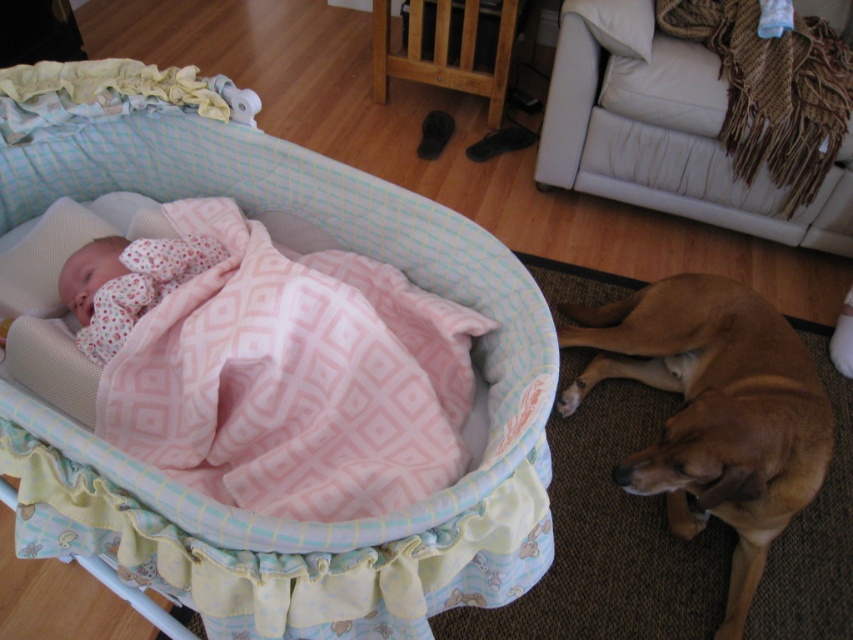
Question: Does brown smooth dog at lower right appear over fluffy pink blanket at center?

Choices:
 (A) yes
 (B) no

Answer: (B)

Question: Which object is positioned closest to the fluffy pink blanket at center?

Choices:
 (A) pink fabric infant bed at center
 (B) brown smooth dog at lower right

Answer: (A)

Question: Which object is positioned farthest from the fluffy pink blanket at center?

Choices:
 (A) pink fabric infant bed at center
 (B) brown smooth dog at lower right

Answer: (B)

Question: Which is farther from the brown smooth dog at lower right?

Choices:
 (A) pink fabric infant bed at center
 (B) fluffy pink blanket at center

Answer: (B)

Question: Is pink fabric infant bed at center positioned before fluffy pink blanket at center?

Choices:
 (A) no
 (B) yes

Answer: (B)

Question: Where is pink fabric infant bed at center located in relation to brown smooth dog at lower right in the image?

Choices:
 (A) left
 (B) right

Answer: (A)